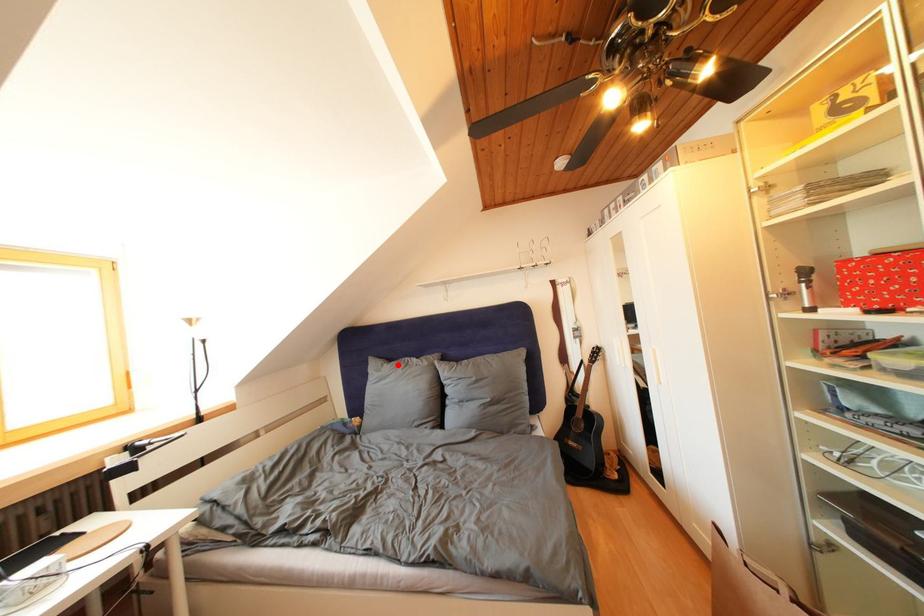
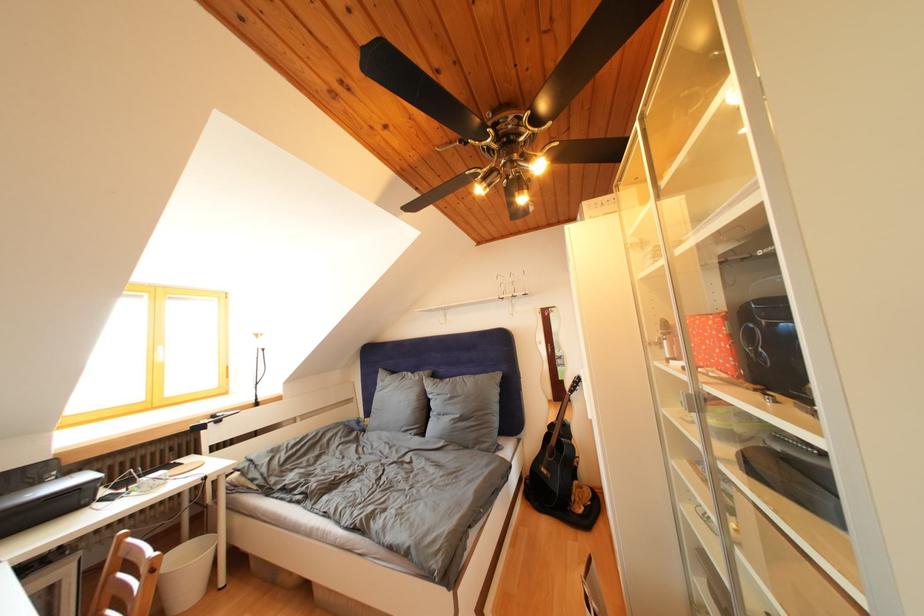
In the second image, find the point that corresponds to the highlighted location in the first image.

(400, 378)